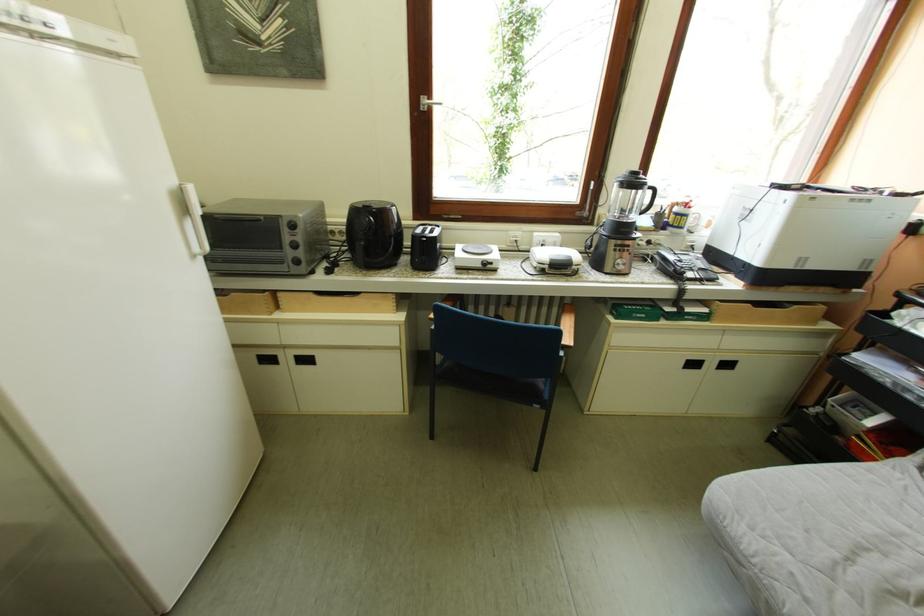
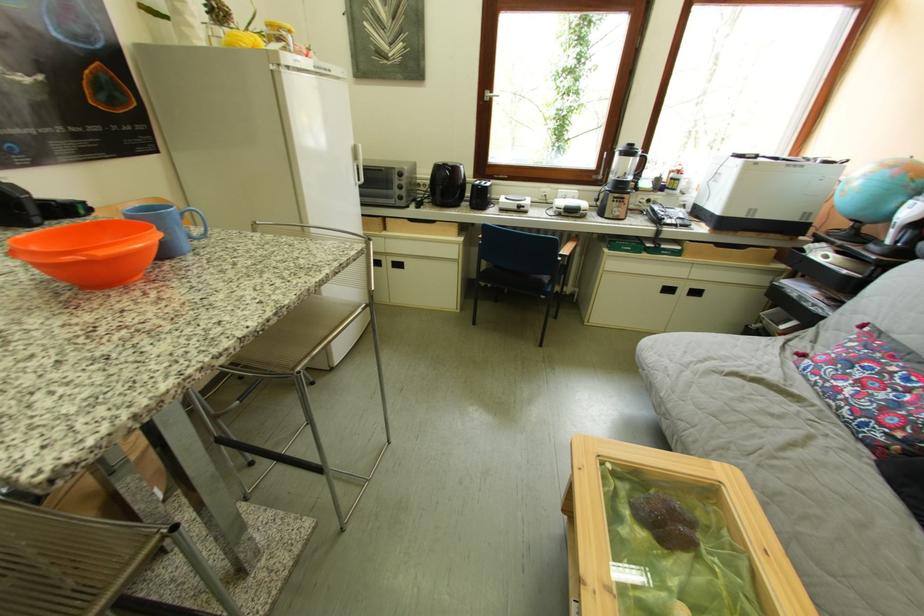
The point at (x=300, y=360) is marked in the first image. Where is the corresponding point in the second image?

(399, 265)